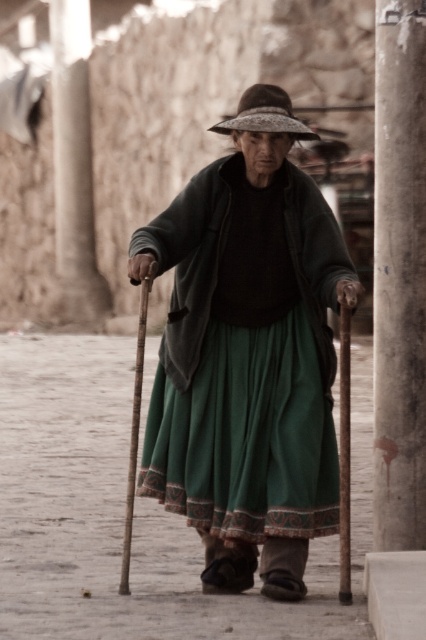
You are a delivery person who needs to place a small package on the dusty concrete pavement at center. However, there is a brown straw hat at center in the way. Can you move the hat to the side to make space for the package?

The dusty concrete pavement at center is wider than the brown straw hat at center, so there is enough space to move the hat aside and place the package.

You are standing in the scene and want to take a photo of the elderly woman. The camera you are using has a focus range of 5 meters. Can you focus on the point at coordinates point (x=350, y=556) without moving closer?

The distance of point (x=350, y=556) from camera is 6.39 meters, which exceeds the camera focus range of 5 meters. Therefore, you cannot focus on the point (x=350, y=556) without moving closer.

You are an architect designing a new public space and want to ensure accessibility for all visitors. You observe the elderly woman using two wooden canes and notice the smooth concrete pillar at right and the wooden cane at center. Which object should you consider for designing a support structure that is more substantial in size?

The wooden cane at center should be considered for designing a support structure since the smooth concrete pillar at right is smaller than the wooden cane at center, indicating the need for a larger and more robust design.